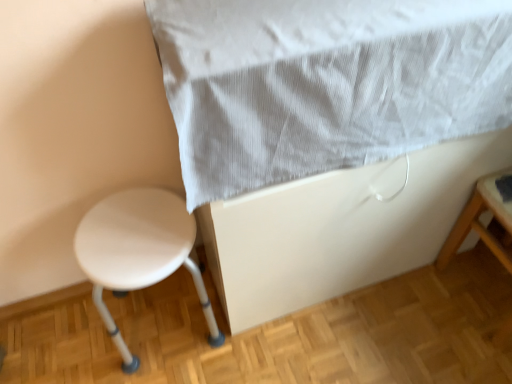
Question: Does white plastic stool at lower left lie behind white textured fabric at upper center?

Choices:
 (A) no
 (B) yes

Answer: (B)

Question: Considering the relative positions of white plastic stool at lower left and white textured fabric at upper center in the image provided, is white plastic stool at lower left to the right of white textured fabric at upper center from the viewer's perspective?

Choices:
 (A) no
 (B) yes

Answer: (A)

Question: Is white plastic stool at lower left smaller than white textured fabric at upper center?

Choices:
 (A) no
 (B) yes

Answer: (B)

Question: Is white plastic stool at lower left to the left of white textured fabric at upper center from the viewer's perspective?

Choices:
 (A) no
 (B) yes

Answer: (B)

Question: Is white plastic stool at lower left outside white textured fabric at upper center?

Choices:
 (A) yes
 (B) no

Answer: (A)

Question: Is white plastic stool at lower left oriented away from white textured fabric at upper center?

Choices:
 (A) no
 (B) yes

Answer: (A)

Question: Can you see white textured fabric at upper center touching white plastic stool at lower left?

Choices:
 (A) yes
 (B) no

Answer: (B)

Question: Is white textured fabric at upper center wider than white plastic stool at lower left?

Choices:
 (A) yes
 (B) no

Answer: (A)

Question: Can we say white textured fabric at upper center lies outside white plastic stool at lower left?

Choices:
 (A) yes
 (B) no

Answer: (A)

Question: Considering the relative sizes of white textured fabric at upper center and white plastic stool at lower left in the image provided, is white textured fabric at upper center thinner than white plastic stool at lower left?

Choices:
 (A) yes
 (B) no

Answer: (B)

Question: Can white plastic stool at lower left be found inside white textured fabric at upper center?

Choices:
 (A) no
 (B) yes

Answer: (A)

Question: Could you tell me if white textured fabric at upper center is facing white plastic stool at lower left?

Choices:
 (A) no
 (B) yes

Answer: (A)

Question: Looking at the image, does white plastic stool at lower left seem bigger or smaller compared to white textured fabric at upper center?

Choices:
 (A) big
 (B) small

Answer: (B)